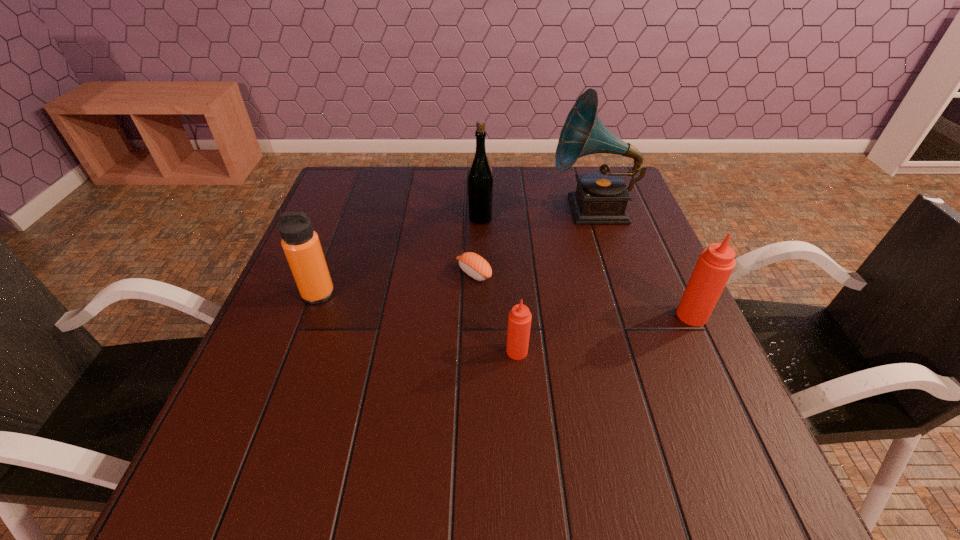
Find the location of a particular element. This screenshot has width=960, height=540. object located in the far right corner section of the desktop is located at coordinates (601, 197).

Identify the location of free space at the far edge. The width and height of the screenshot is (960, 540). point(457,201).

The image size is (960, 540). Find the location of `free space at the near edge of the desktop`. free space at the near edge of the desktop is located at coordinates (397, 428).

In the image, there is a desktop. Where is `vacant space at the right edge`? The width and height of the screenshot is (960, 540). vacant space at the right edge is located at coordinates (644, 227).

Locate an element on the screen. vacant region at the far left corner of the desktop is located at coordinates (365, 170).

In the image, there is a desktop. At what (x,y) coordinates should I click in order to perform the action: click on vacant space at the near left corner. Please return your answer as a coordinate pair (x, y). Looking at the image, I should click on (281, 408).

The width and height of the screenshot is (960, 540). Find the location of `vacant space at the near right corner of the desktop`. vacant space at the near right corner of the desktop is located at coordinates (729, 423).

In order to click on vacant region between the second tallest object and the shortest object in this screenshot , I will do `click(477, 246)`.

Find the location of a particular element. The width and height of the screenshot is (960, 540). empty space that is in between the taller Tabasco sauce and the shortest object is located at coordinates (583, 294).

At what (x,y) coordinates should I click in order to perform the action: click on vacant region between the farther Tabasco sauce and the leftmost object. Please return your answer as a coordinate pair (x, y). This screenshot has width=960, height=540. Looking at the image, I should click on (505, 305).